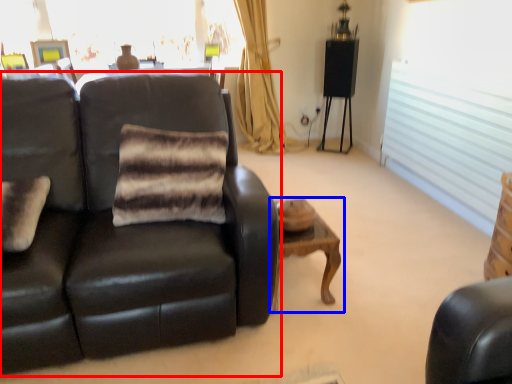
Question: Which object is closer to the camera taking this photo, studio couch (highlighted by a red box) or table (highlighted by a blue box)?

Choices:
 (A) studio couch
 (B) table

Answer: (A)